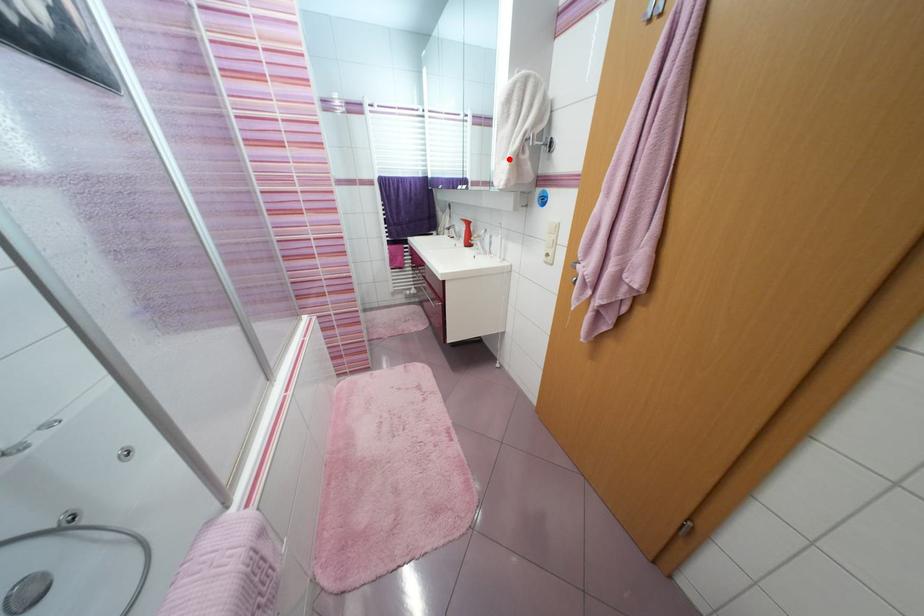
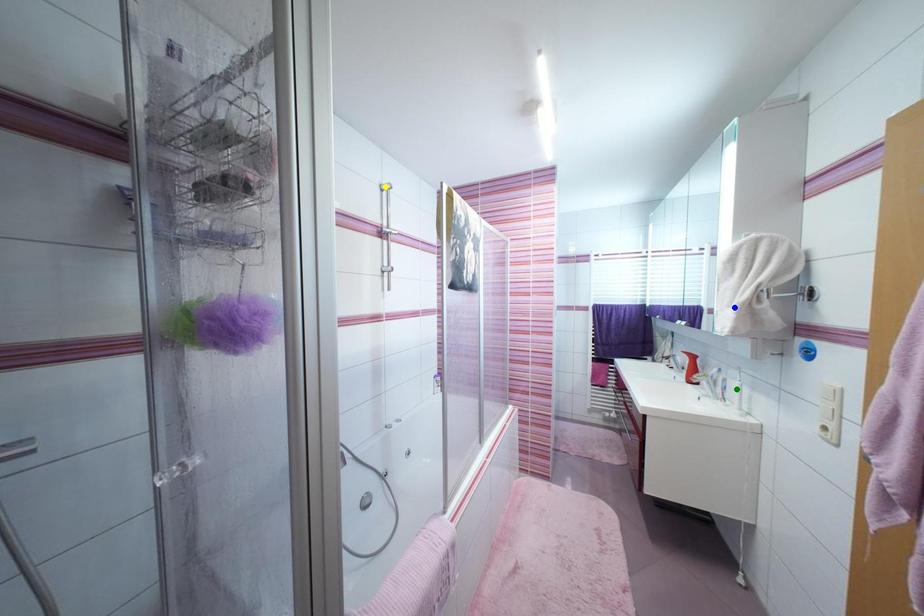
Question: I am providing you with two images of the same scene from different viewpoints. A red point is marked on the first image. You are given multiple points on the second image. Which point in image 2 is actually the same real-world point as the red point in image 1?

Choices:
 (A) blue point
 (B) green point
 (C) yellow point

Answer: (A)